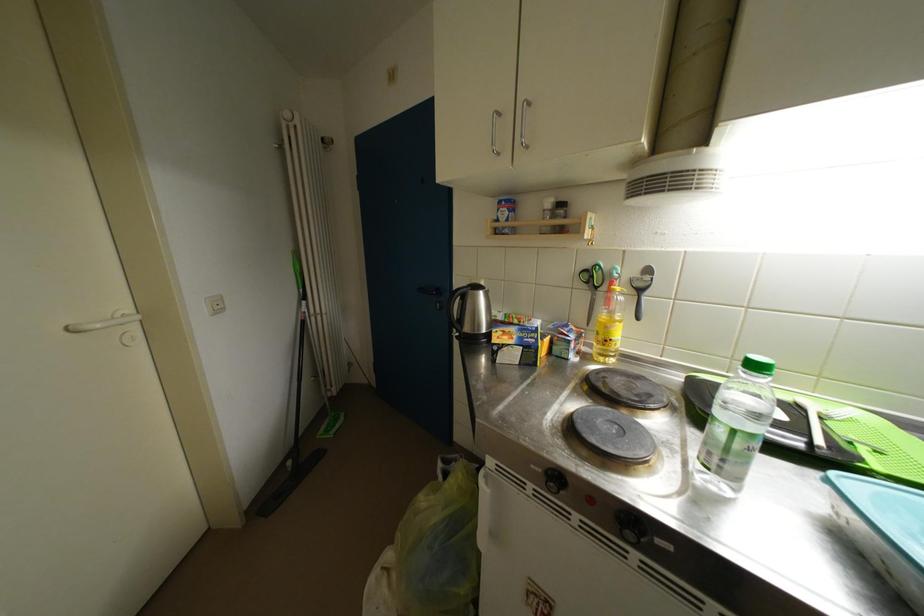
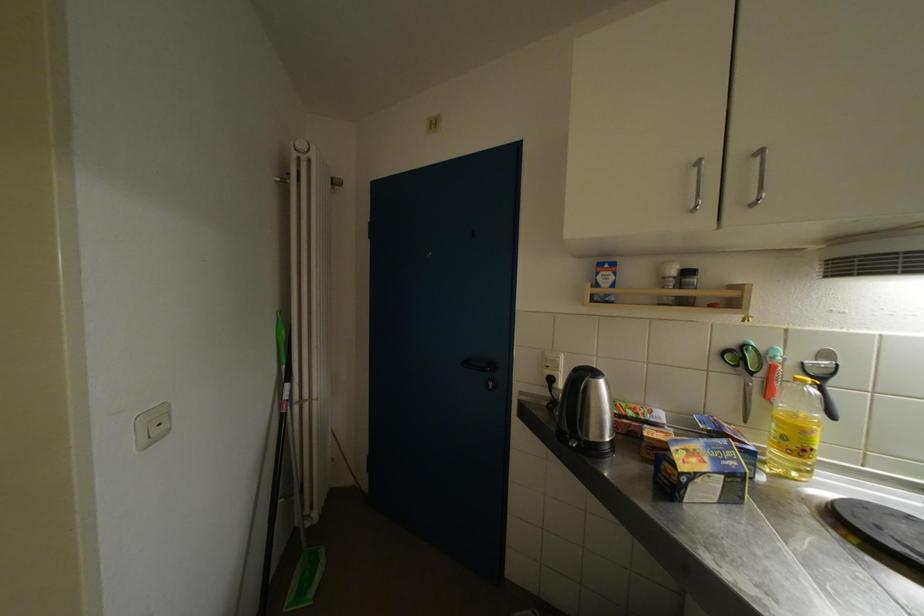
Question: The first image is from the beginning of the video and the second image is from the end. How did the camera likely rotate when shooting the video?

Choices:
 (A) Left
 (B) Right
 (C) Up
 (D) Down

Answer: (B)